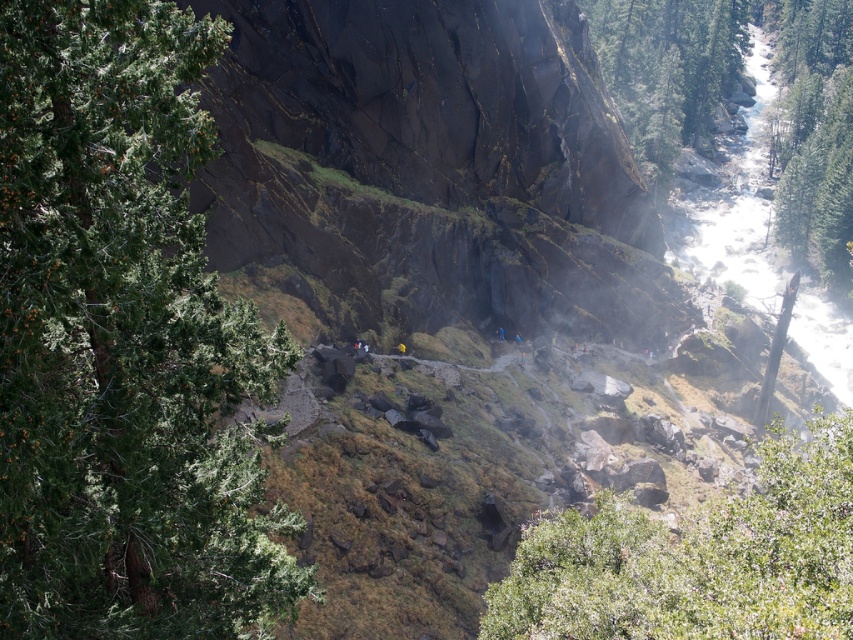
Question: Which is farther from the green textured tree at right?

Choices:
 (A) green leafy tree at left
 (B) green textured tree at upper center

Answer: (A)

Question: Is the position of green leafy tree at left more distant than that of green textured tree at upper center?

Choices:
 (A) yes
 (B) no

Answer: (B)

Question: Which point appears closest to the camera in this image?

Choices:
 (A) [x=732, y=522]
 (B) [x=804, y=236]
 (C) [x=120, y=164]

Answer: (C)

Question: Is green leafy tree at lower right closer to camera compared to green textured tree at upper center?

Choices:
 (A) yes
 (B) no

Answer: (A)

Question: Can you confirm if green leafy tree at left is positioned below green leafy tree at lower right?

Choices:
 (A) no
 (B) yes

Answer: (A)

Question: Which of the following is the farthest from the observer?

Choices:
 (A) (19, 68)
 (B) (807, 502)
 (C) (689, 33)

Answer: (C)